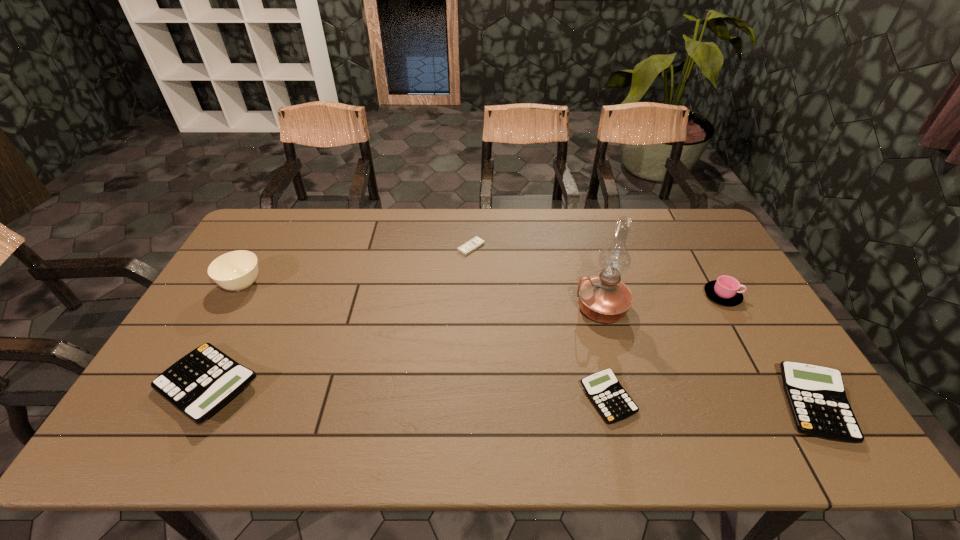
To make them evenly spaced by inserting another calculator among them, please locate a free space for this new calculator. Please provide its 2D coordinates. Your answer should be formatted as a tuple, i.e. [(x, y)], where the tuple contains the x and y coordinates of a point satisfying the conditions above.

[(406, 393)]